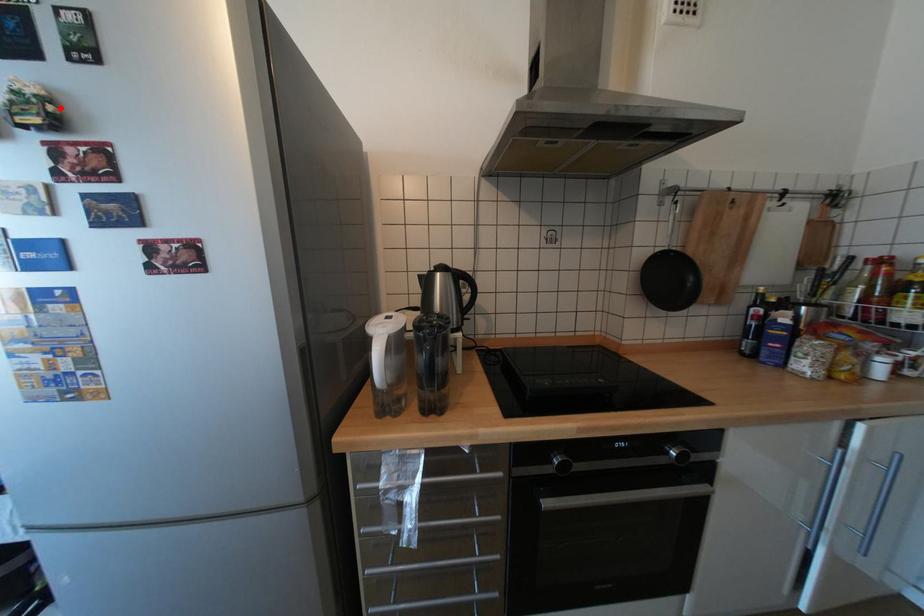
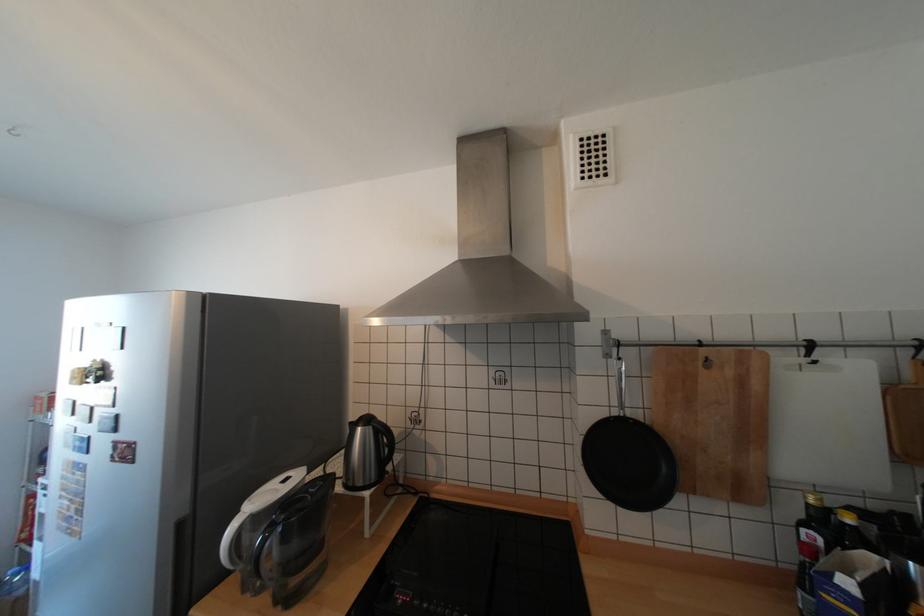
Question: I am providing you with two images of the same scene from different viewpoints. A red point is shown in image1. For the corresponding object point in image2, is it positioned nearer or farther from the camera?

Choices:
 (A) Nearer
 (B) Farther

Answer: (A)